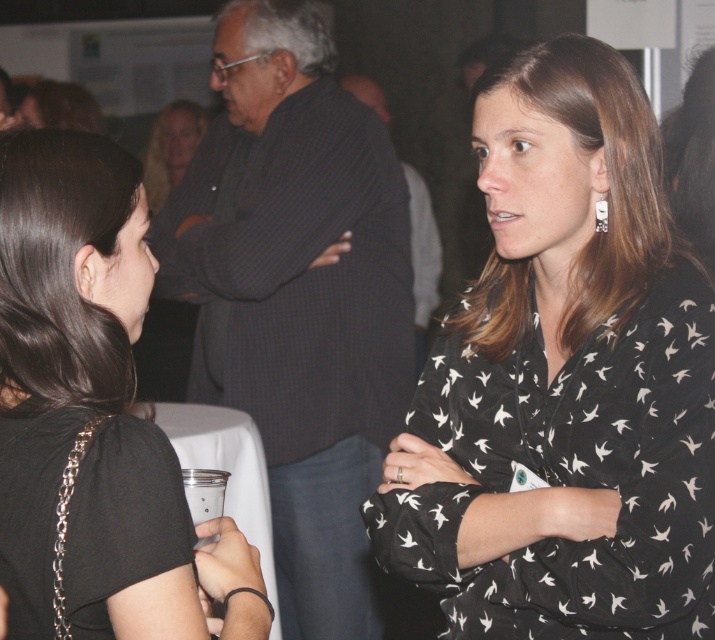
Does matte black shirt at upper center have a lesser height compared to clear plastic cup at lower center?

No.

Can you confirm if matte black shirt at upper center is positioned to the right of clear plastic cup at lower center?

Incorrect, matte black shirt at upper center is not on the right side of clear plastic cup at lower center.

Does point (164, 179) come farther from viewer compared to point (217, 476)?

Yes.

Identify the location of matte black shirt at upper center. (169, 148).

Can you confirm if dark gray checkered shirt at center is positioned to the right of clear plastic cup at lower center?

In fact, dark gray checkered shirt at center is to the left of clear plastic cup at lower center.

Which is more to the right, dark gray checkered shirt at center or clear plastic cup at lower center?

From the viewer's perspective, clear plastic cup at lower center appears more on the right side.

Looking at this image, who is more forward, (393,163) or (197,493)?

Point (197,493)

The width and height of the screenshot is (715, 640). In order to click on dark gray checkered shirt at center in this screenshot , I will do `click(297, 296)`.

Can you confirm if dark gray checkered shirt at center is taller than black matte shirt at left?

Indeed, dark gray checkered shirt at center has a greater height compared to black matte shirt at left.

From the picture: Which is above, dark gray checkered shirt at center or black matte shirt at left?

dark gray checkered shirt at center

You are a GUI agent. You are given a task and a screenshot of the screen. Output one action in this format:
    pyautogui.click(x=<x>, y=<y>)
    Task: Click on the dark gray checkered shirt at center
    Image resolution: width=715 pixels, height=640 pixels.
    Given the screenshot: What is the action you would take?
    pyautogui.click(x=297, y=296)

In order to click on dark gray checkered shirt at center in this screenshot , I will do `click(297, 296)`.